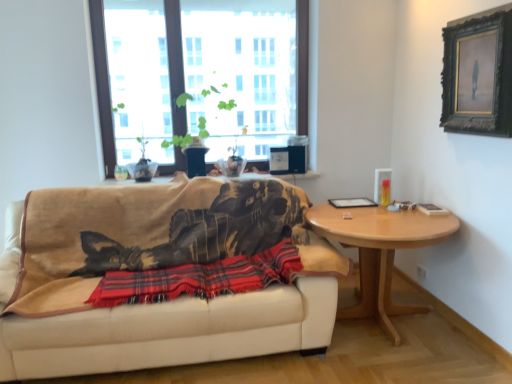
Question: Is beige fabric couch at center taller than black wooden picture frame at upper right?

Choices:
 (A) no
 (B) yes

Answer: (B)

Question: Can you confirm if beige fabric couch at center is shorter than black wooden picture frame at upper right?

Choices:
 (A) no
 (B) yes

Answer: (A)

Question: Is beige fabric couch at center further to camera compared to black wooden picture frame at upper right?

Choices:
 (A) no
 (B) yes

Answer: (A)

Question: Does beige fabric couch at center have a lesser width compared to black wooden picture frame at upper right?

Choices:
 (A) yes
 (B) no

Answer: (B)

Question: Is beige fabric couch at center oriented away from black wooden picture frame at upper right?

Choices:
 (A) no
 (B) yes

Answer: (A)

Question: From a real-world perspective, is beige fabric couch at center positioned above or below black wooden picture frame at upper right?

Choices:
 (A) below
 (B) above

Answer: (A)

Question: Based on their positions, is beige fabric couch at center located to the left or right of black wooden picture frame at upper right?

Choices:
 (A) right
 (B) left

Answer: (B)

Question: Is beige fabric couch at center situated inside black wooden picture frame at upper right or outside?

Choices:
 (A) outside
 (B) inside

Answer: (A)

Question: From the image's perspective, is beige fabric couch at center positioned above or below black wooden picture frame at upper right?

Choices:
 (A) above
 (B) below

Answer: (B)

Question: Visually, is red plaid blanket at center positioned to the left or to the right of beige fabric couch at center?

Choices:
 (A) left
 (B) right

Answer: (B)

Question: Relative to beige fabric couch at center, is red plaid blanket at center in front or behind?

Choices:
 (A) front
 (B) behind

Answer: (B)

Question: From their relative heights in the image, would you say red plaid blanket at center is taller or shorter than beige fabric couch at center?

Choices:
 (A) tall
 (B) short

Answer: (B)

Question: Does point (259, 263) appear closer or farther from the camera than point (120, 213)?

Choices:
 (A) closer
 (B) farther

Answer: (A)

Question: Is green matte plant at upper center inside the boundaries of beige fabric couch at center, or outside?

Choices:
 (A) outside
 (B) inside

Answer: (A)

Question: From their relative heights in the image, would you say green matte plant at upper center is taller or shorter than beige fabric couch at center?

Choices:
 (A) short
 (B) tall

Answer: (A)